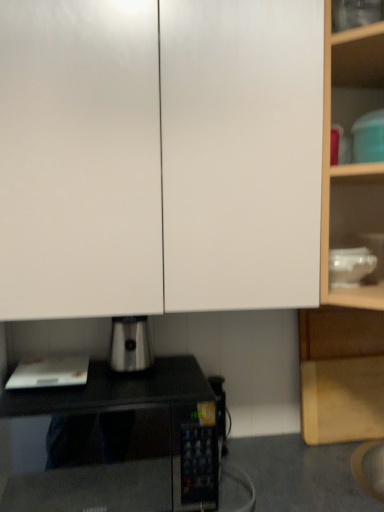
This screenshot has width=384, height=512. What are the coordinates of `teal plastic container at upper right, the first appliance viewed from the top` in the screenshot? It's located at (369, 137).

Find the location of a particular element. satin silver coffee maker at lower center is located at coordinates (130, 344).

Find the location of a particular element. white matte paper at lower left, which is the 3th appliance in right-to-left order is located at coordinates (49, 372).

This screenshot has height=512, width=384. Find the location of `transparent glass bowl at upper right, arranged as the 2th appliance when viewed from the top`. transparent glass bowl at upper right, arranged as the 2th appliance when viewed from the top is located at coordinates point(350,265).

This screenshot has width=384, height=512. In order to click on teal plastic container at upper right, the first appliance viewed from the top in this screenshot , I will do `click(369, 137)`.

From the image's perspective, is satin silver coffee maker at lower center located beneath black matte microwave oven at center?

No, from the image's perspective, satin silver coffee maker at lower center is not below black matte microwave oven at center.

Is satin silver coffee maker at lower center not within black matte microwave oven at center?

Yes, satin silver coffee maker at lower center is not within black matte microwave oven at center.

Does satin silver coffee maker at lower center have a larger size compared to black matte microwave oven at center?

No.

Considering the relative positions of satin silver coffee maker at lower center and black matte microwave oven at center in the image provided, is satin silver coffee maker at lower center behind black matte microwave oven at center?

Yes, satin silver coffee maker at lower center is behind black matte microwave oven at center.

Is teal plastic container at upper right, which is the third appliance in bottom-to-top order, oriented away from white matte paper at lower left, the third appliance in the top-to-bottom sequence?

No, teal plastic container at upper right, which is the third appliance in bottom-to-top order, is not facing away from white matte paper at lower left, the third appliance in the top-to-bottom sequence.

Considering the relative sizes of teal plastic container at upper right, which is the third appliance in bottom-to-top order, and white matte paper at lower left, placed as the 1th appliance when sorted from bottom to top, in the image provided, is teal plastic container at upper right, which is the third appliance in bottom-to-top order, bigger than white matte paper at lower left, placed as the 1th appliance when sorted from bottom to top,?

Indeed, teal plastic container at upper right, which is the third appliance in bottom-to-top order, has a larger size compared to white matte paper at lower left, placed as the 1th appliance when sorted from bottom to top.

Considering the positions of objects teal plastic container at upper right, the third appliance when ordered from left to right, and white matte paper at lower left, placed as the 1th appliance when sorted from bottom to top, in the image provided, who is in front, teal plastic container at upper right, the third appliance when ordered from left to right, or white matte paper at lower left, placed as the 1th appliance when sorted from bottom to top,?

Positioned in front is teal plastic container at upper right, the third appliance when ordered from left to right.

Which is behind, point (360, 153) or point (15, 382)?

The point (360, 153) is farther from the camera.

Who is taller, black matte microwave oven at center or wooden cabinet at right, which appears as the first cabinetry when viewed from the back?

wooden cabinet at right, which appears as the first cabinetry when viewed from the back, is taller.

How many degrees apart are the facing directions of black matte microwave oven at center and wooden cabinet at right, the second cabinetry in the left-to-right sequence?

The angle between the facing direction of black matte microwave oven at center and the facing direction of wooden cabinet at right, the second cabinetry in the left-to-right sequence, is 0.38 degrees.

From the image's perspective, is black matte microwave oven at center located above or below wooden cabinet at right, which appears as the first cabinetry when viewed from the back?

Based on their image positions, black matte microwave oven at center is located beneath wooden cabinet at right, which appears as the first cabinetry when viewed from the back.

Is black matte microwave oven at center situated inside wooden cabinet at right, the second cabinetry when ordered from top to bottom, or outside?

The correct answer is: outside.

Does white matte paper at lower left, the first appliance in the left-to-right sequence, have a lesser width compared to white glossy cabinet doors at upper center, which is counted as the second cabinetry, starting from the bottom?

Indeed, white matte paper at lower left, the first appliance in the left-to-right sequence, has a lesser width compared to white glossy cabinet doors at upper center, which is counted as the second cabinetry, starting from the bottom.

Who is bigger, white matte paper at lower left, which is the 3th appliance in right-to-left order, or white glossy cabinet doors at upper center, which is counted as the second cabinetry, starting from the bottom?

With larger size is white glossy cabinet doors at upper center, which is counted as the second cabinetry, starting from the bottom.

Is white matte paper at lower left, placed as the 1th appliance when sorted from bottom to top, positioned with its back to white glossy cabinet doors at upper center, placed as the 2th cabinetry when sorted from back to front?

No, white matte paper at lower left, placed as the 1th appliance when sorted from bottom to top, is not facing away from white glossy cabinet doors at upper center, placed as the 2th cabinetry when sorted from back to front.

Considering the relative positions of transparent glass bowl at upper right, arranged as the 2th appliance when viewed from the top, and wooden cabinet at right, which is the 2th cabinetry from front to back, in the image provided, is transparent glass bowl at upper right, arranged as the 2th appliance when viewed from the top, behind wooden cabinet at right, which is the 2th cabinetry from front to back,?

That is False.

Who is shorter, transparent glass bowl at upper right, placed as the 2th appliance when sorted from bottom to top, or wooden cabinet at right, acting as the 1th cabinetry starting from the bottom?

transparent glass bowl at upper right, placed as the 2th appliance when sorted from bottom to top.

In the scene shown: Which of these two, transparent glass bowl at upper right, which ranks as the 2th appliance in right-to-left order, or wooden cabinet at right, which is counted as the first cabinetry, starting from the right, is wider?

With larger width is transparent glass bowl at upper right, which ranks as the 2th appliance in right-to-left order.

Can you see transparent glass bowl at upper right, placed as the 2th appliance when sorted from left to right, touching wooden cabinet at right, acting as the 1th cabinetry starting from the bottom?

No, transparent glass bowl at upper right, placed as the 2th appliance when sorted from left to right, is not touching wooden cabinet at right, acting as the 1th cabinetry starting from the bottom.

Can you confirm if white glossy cabinet doors at upper center, placed as the 1th cabinetry when sorted from top to bottom, is positioned to the left of teal plastic container at upper right, positioned as the first appliance in right-to-left order?

Yes, white glossy cabinet doors at upper center, placed as the 1th cabinetry when sorted from top to bottom, is to the left of teal plastic container at upper right, positioned as the first appliance in right-to-left order.

Is white glossy cabinet doors at upper center, which is the 1th cabinetry in front-to-back order, not near teal plastic container at upper right, which is the third appliance in bottom-to-top order?

No, white glossy cabinet doors at upper center, which is the 1th cabinetry in front-to-back order, is not far away from teal plastic container at upper right, which is the third appliance in bottom-to-top order.

Is white glossy cabinet doors at upper center, placed as the second cabinetry when sorted from right to left, thinner than teal plastic container at upper right, the third appliance when ordered from left to right?

No, white glossy cabinet doors at upper center, placed as the second cabinetry when sorted from right to left, is not thinner than teal plastic container at upper right, the third appliance when ordered from left to right.

Who is bigger, white glossy cabinet doors at upper center, which is counted as the second cabinetry, starting from the bottom, or teal plastic container at upper right, the third appliance when ordered from left to right?

With larger size is white glossy cabinet doors at upper center, which is counted as the second cabinetry, starting from the bottom.

Are white matte paper at lower left, placed as the 1th appliance when sorted from bottom to top, and satin silver coffee maker at lower center far apart?

No, white matte paper at lower left, placed as the 1th appliance when sorted from bottom to top, is in close proximity to satin silver coffee maker at lower center.

From a real-world perspective, is white matte paper at lower left, the first appliance in the left-to-right sequence, physically located above or below satin silver coffee maker at lower center?

Clearly, from a real-world perspective, white matte paper at lower left, the first appliance in the left-to-right sequence, is below satin silver coffee maker at lower center.

Is satin silver coffee maker at lower center at the back of white matte paper at lower left, which is the 3th appliance in right-to-left order?

No, white matte paper at lower left, which is the 3th appliance in right-to-left order, is not facing the opposite direction of satin silver coffee maker at lower center.

I want to click on microwave oven below the satin silver coffee maker at lower center (from the image's perspective), so pos(117,393).

From the image's perspective, count 2nd appliances upward from the white matte paper at lower left, placed as the 1th appliance when sorted from bottom to top, and point to it. Please provide its 2D coordinates.

[(369, 137)]

Based on their spatial positions, is black matte microwave oven at center or transparent glass bowl at upper right, arranged as the 2th appliance when viewed from the top, closer to satin silver coffee maker at lower center?

black matte microwave oven at center lies closer to satin silver coffee maker at lower center than the other object.

Estimate the real-world distances between objects in this image. Which object is closer to transparent glass bowl at upper right, arranged as the 2th appliance when viewed from the top, satin silver coffee maker at lower center or wooden cabinet at right, which is the 2th cabinetry from front to back?

The object closer to transparent glass bowl at upper right, arranged as the 2th appliance when viewed from the top, is wooden cabinet at right, which is the 2th cabinetry from front to back.

Which object lies further to the anchor point teal plastic container at upper right, which is the third appliance in bottom-to-top order, transparent glass bowl at upper right, placed as the 2th appliance when sorted from left to right, or black matte microwave oven at center?

black matte microwave oven at center is positioned further to the anchor teal plastic container at upper right, which is the third appliance in bottom-to-top order.

From the image, which object appears to be farther from wooden cabinet at right, which is the 2th cabinetry from front to back, transparent glass bowl at upper right, placed as the 2th appliance when sorted from bottom to top, or white matte paper at lower left, the first appliance in the left-to-right sequence?

white matte paper at lower left, the first appliance in the left-to-right sequence, lies further to wooden cabinet at right, which is the 2th cabinetry from front to back, than the other object.

From the image, which object appears to be farther from transparent glass bowl at upper right, placed as the 2th appliance when sorted from left to right, white glossy cabinet doors at upper center, which is the 1th cabinetry in front-to-back order, or satin silver coffee maker at lower center?

Based on the image, satin silver coffee maker at lower center appears to be further to transparent glass bowl at upper right, placed as the 2th appliance when sorted from left to right.

Estimate the real-world distances between objects in this image. Which object is closer to transparent glass bowl at upper right, which ranks as the 2th appliance in right-to-left order, satin silver coffee maker at lower center or black matte microwave oven at center?

satin silver coffee maker at lower center.

Based on their spatial positions, is wooden cabinet at right, which is counted as the first cabinetry, starting from the right, or white matte paper at lower left, the third appliance in the top-to-bottom sequence, closer to transparent glass bowl at upper right, arranged as the 2th appliance when viewed from the top?

wooden cabinet at right, which is counted as the first cabinetry, starting from the right, lies closer to transparent glass bowl at upper right, arranged as the 2th appliance when viewed from the top, than the other object.

When comparing their distances from satin silver coffee maker at lower center, does wooden cabinet at right, which appears as the first cabinetry when viewed from the back, or white matte paper at lower left, placed as the 1th appliance when sorted from bottom to top, seem further?

wooden cabinet at right, which appears as the first cabinetry when viewed from the back, lies further to satin silver coffee maker at lower center than the other object.

At what (x,y) coordinates should I click in order to perform the action: click on microwave oven between white matte paper at lower left, which is the 3th appliance in right-to-left order, and wooden cabinet at right, the second cabinetry when ordered from top to bottom. Please return your answer as a coordinate pair (x, y). This screenshot has height=512, width=384. Looking at the image, I should click on (117, 393).

The image size is (384, 512). Identify the location of appliance between white glossy cabinet doors at upper center, which is the 1th cabinetry in front-to-back order, and teal plastic container at upper right, which is the third appliance in bottom-to-top order, in the horizontal direction. (350, 265).

Locate an element on the screen. This screenshot has height=512, width=384. coffee maker situated between white matte paper at lower left, which is the 3th appliance in right-to-left order, and transparent glass bowl at upper right, arranged as the 2th appliance when viewed from the top, from left to right is located at coordinates (130, 344).

I want to click on coffee maker between black matte microwave oven at center and wooden cabinet at right, the second cabinetry in the left-to-right sequence, from left to right, so (130, 344).